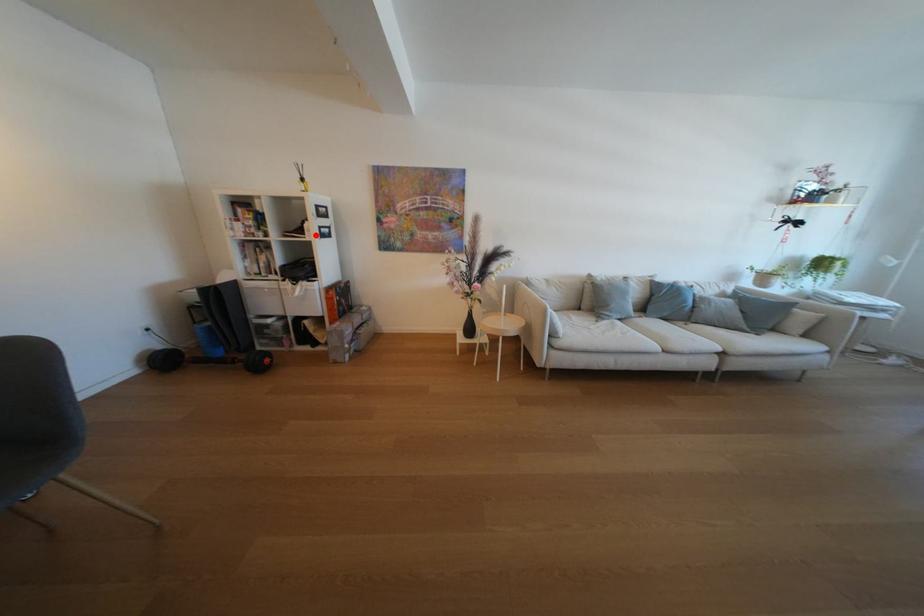
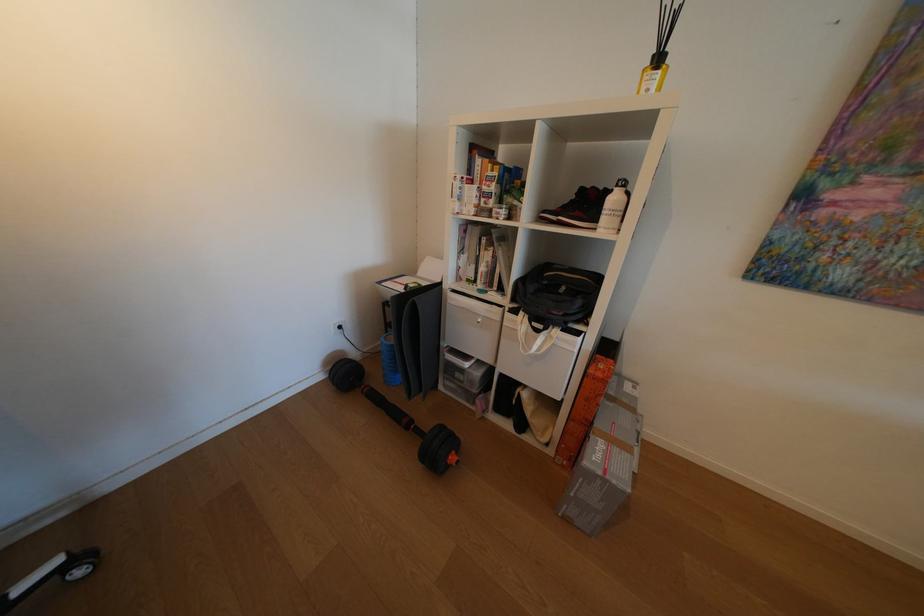
Locate, in the second image, the point that corresponds to the highlighted location in the first image.

(608, 222)